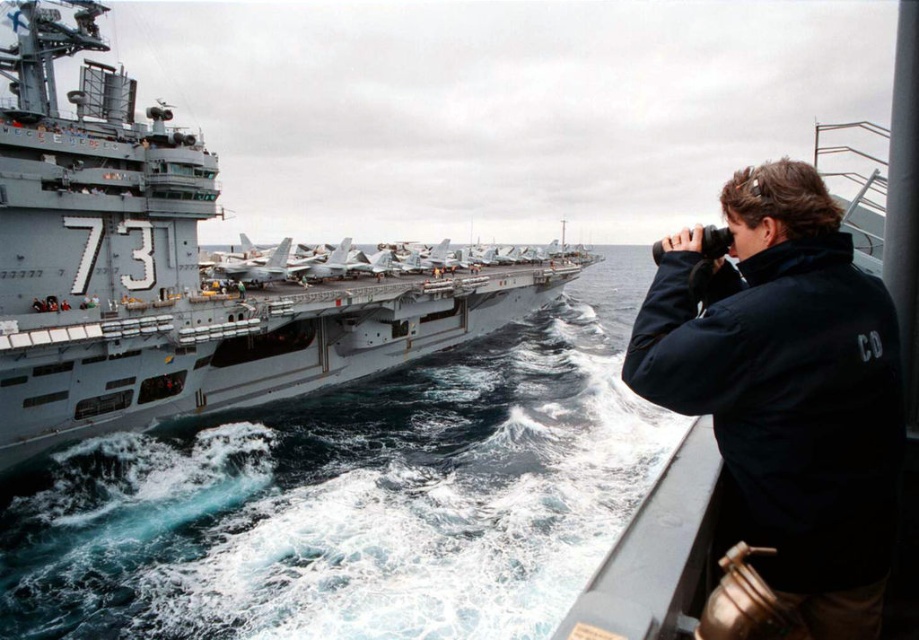
Is gray metallic aircraft carrier at center shorter than black softshell jacket at right?

No, gray metallic aircraft carrier at center is not shorter than black softshell jacket at right.

The image size is (919, 640). Describe the element at coordinates (171, 269) in the screenshot. I see `gray metallic aircraft carrier at center` at that location.

Is point (16, 308) positioned before point (797, 428)?

No, (16, 308) is further to viewer.

At what (x,y) coordinates should I click in order to perform the action: click on gray metallic aircraft carrier at center. Please return your answer as a coordinate pair (x, y). The image size is (919, 640). Looking at the image, I should click on (171, 269).

Identify the location of blue water at lower left. The image size is (919, 640). (356, 497).

Which is more to the left, blue water at lower left or gray metallic aircraft carrier at center?

Positioned to the left is gray metallic aircraft carrier at center.

The width and height of the screenshot is (919, 640). Describe the element at coordinates (356, 497) in the screenshot. I see `blue water at lower left` at that location.

Find the location of a particular element. blue water at lower left is located at coordinates (356, 497).

In the scene shown: Does blue water at lower left have a greater height compared to black softshell jacket at right?

Yes.

In the scene shown: Who is shorter, blue water at lower left or black softshell jacket at right?

black softshell jacket at right is shorter.

Is point (405, 497) farther from camera compared to point (821, 195)?

Yes, point (405, 497) is behind point (821, 195).

Identify the location of blue water at lower left. (356, 497).